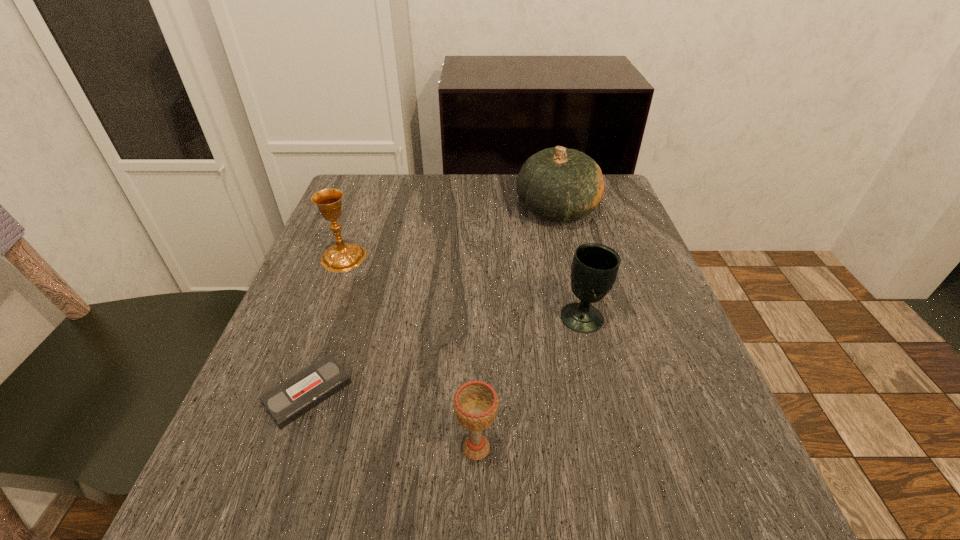
Find the location of `vacant area that satisfies the following two spatial constraints: 1. on the back side of the shortest chalice; 2. on the right side of the gourd`. vacant area that satisfies the following two spatial constraints: 1. on the back side of the shortest chalice; 2. on the right side of the gourd is located at coordinates (478, 210).

Image resolution: width=960 pixels, height=540 pixels. What are the coordinates of `free space in the image that satisfies the following two spatial constraints: 1. on the back side of the videotape; 2. on the right side of the third farthest object` in the screenshot? It's located at (333, 318).

You are a GUI agent. You are given a task and a screenshot of the screen. Output one action in this format:
    pyautogui.click(x=<x>, y=<y>)
    Task: Click on the vacant space that satisfies the following two spatial constraints: 1. on the back side of the shortest chalice; 2. on the left side of the second nearest chalice
    The width and height of the screenshot is (960, 540).
    Given the screenshot: What is the action you would take?
    pyautogui.click(x=477, y=318)